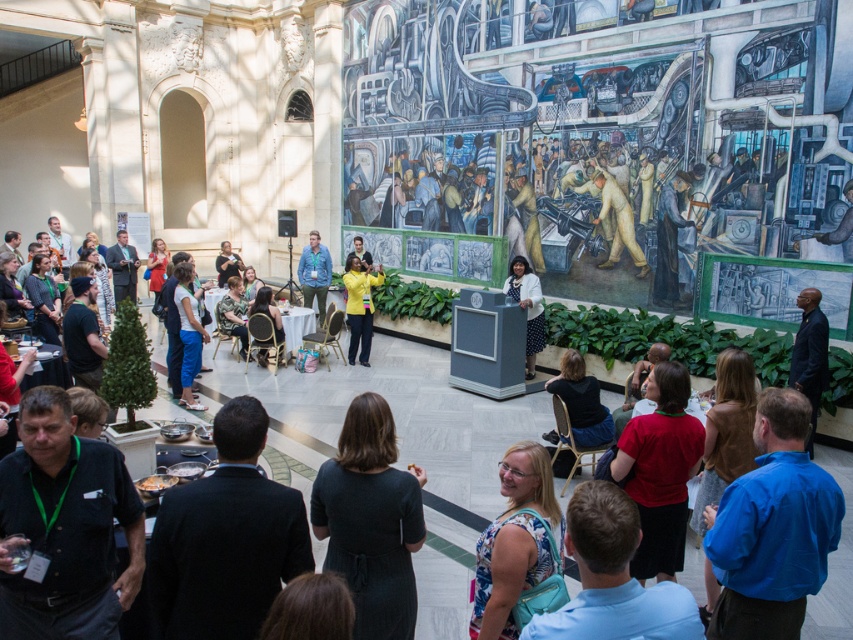
Question: Is matte yellow jacket at center bigger than denim jacket at center?

Choices:
 (A) yes
 (B) no

Answer: (B)

Question: Which point is farther from the camera taking this photo?

Choices:
 (A) (308, 252)
 (B) (405, 596)

Answer: (A)

Question: Considering the relative positions of floral dress at center and white dotted dress at center in the image provided, where is floral dress at center located with respect to white dotted dress at center?

Choices:
 (A) below
 (B) above

Answer: (A)

Question: Which point is closer to the camera?

Choices:
 (A) (500, 472)
 (B) (314, 285)
 (C) (355, 522)
 (D) (520, 276)

Answer: (C)

Question: Based on their relative distances, which object is nearer to the matte yellow jacket at center?

Choices:
 (A) denim jacket at center
 (B) dark gray dress at center
 (C) white dotted dress at center
 (D) floral dress at center

Answer: (A)

Question: Does dark gray dress at center appear on the right side of floral dress at center?

Choices:
 (A) yes
 (B) no

Answer: (B)